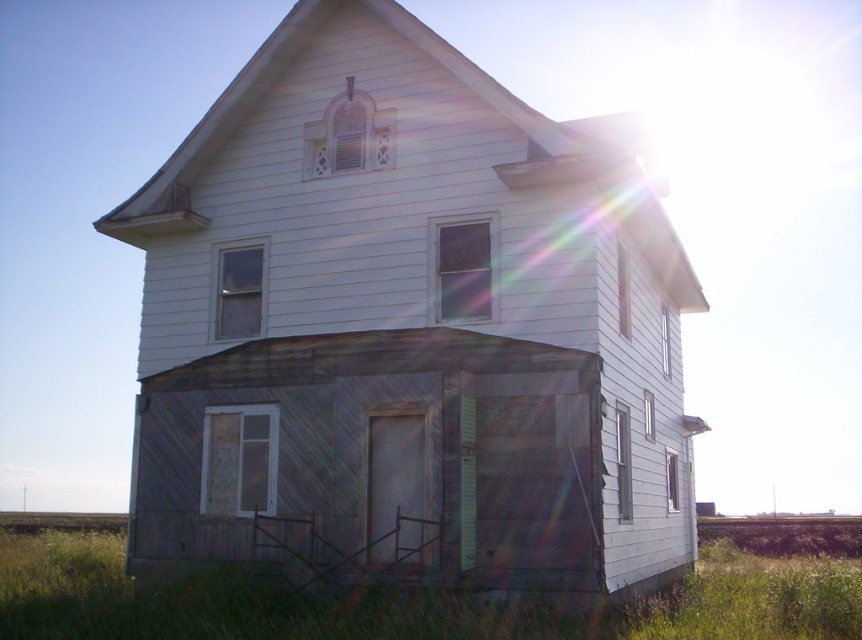
You are standing in front of the old house and notice the white wooden house at center and the green grass at lower center. Which of these two has a wider horizontal span?

The green grass at lower center has a wider horizontal span than the white wooden house at center.

In the scene shown: You are standing on the green grass at lower center and want to approach the white wooden house at center. In which direction should you walk to reach it?

You should walk to your right since the white wooden house at center is located to the right of the green grass at lower center.

Based on the photo, you are standing at point (407, 326). Based on the scene description, what structure is located at this coordinate?

The point (407, 326) is where the white wooden house at center is located.